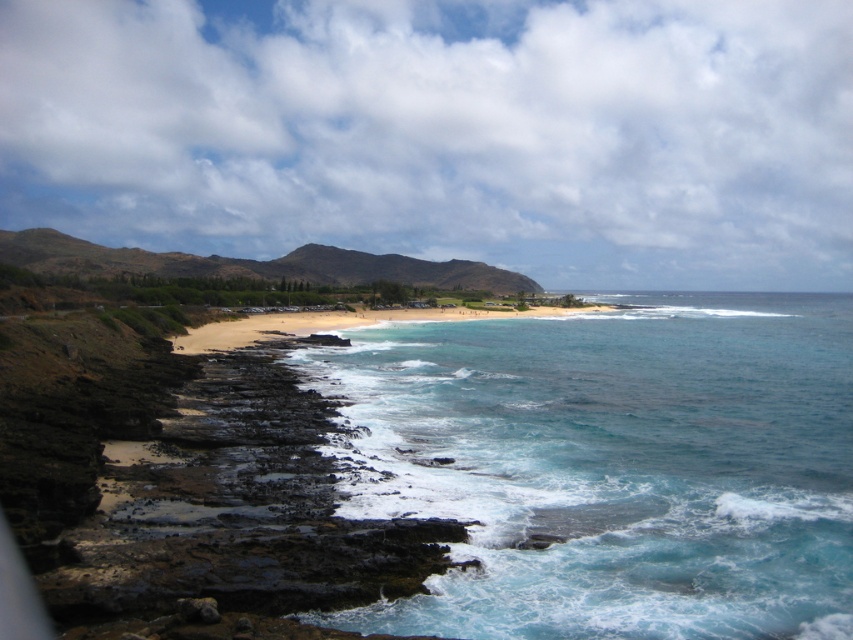
Is the position of clear blue water at center less distant than that of dark brown rocky cliffs at lower left?

No, clear blue water at center is behind dark brown rocky cliffs at lower left.

Does clear blue water at center lie behind dark brown rocky cliffs at lower left?

Yes, clear blue water at center is further from the viewer.

Identify the location of clear blue water at center. The height and width of the screenshot is (640, 853). (613, 465).

Which is more to the right, clear blue water at center or golden sand beach at center?

From the viewer's perspective, clear blue water at center appears more on the right side.

Is clear blue water at center thinner than golden sand beach at center?

In fact, clear blue water at center might be wider than golden sand beach at center.

Does point (583, 426) come farther from viewer compared to point (331, 328)?

No, it is in front of (331, 328).

I want to click on clear blue water at center, so click(x=613, y=465).

Is point (241, 348) more distant than point (222, 342)?

No, it is not.

Where is `dark brown rocky cliffs at lower left`? Image resolution: width=853 pixels, height=640 pixels. dark brown rocky cliffs at lower left is located at coordinates (233, 518).

The height and width of the screenshot is (640, 853). I want to click on dark brown rocky cliffs at lower left, so click(x=233, y=518).